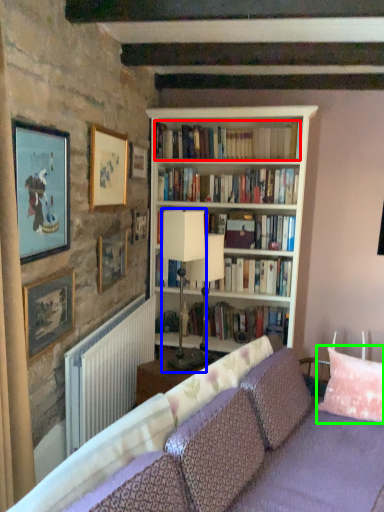
Question: Estimate the real-world distances between objects in this image. Which object is closer to book (highlighted by a red box), table lamp (highlighted by a blue box) or pillow (highlighted by a green box)?

Choices:
 (A) table lamp
 (B) pillow

Answer: (A)